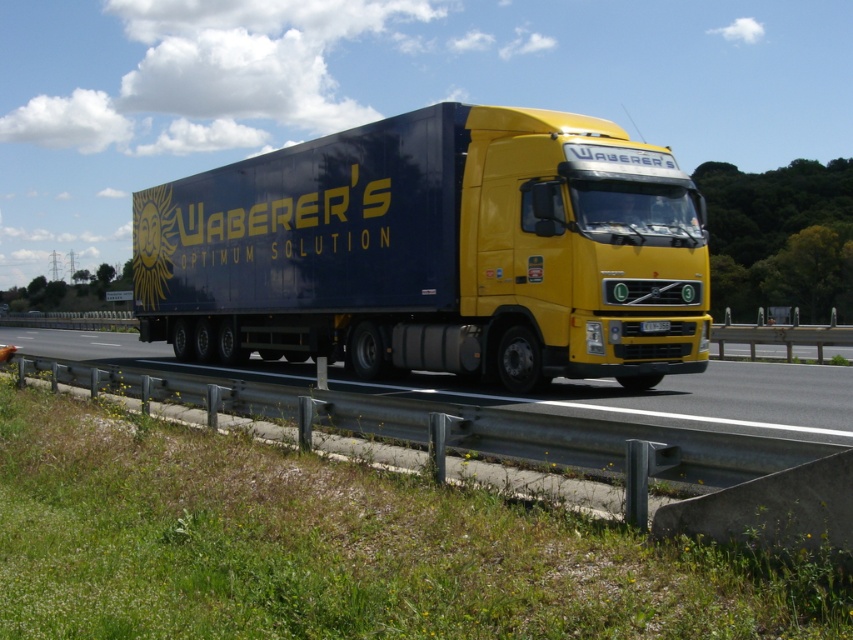
Between matte black trailer truck at center and metallic gray highway at lower center, which one is positioned higher?

Positioned higher is matte black trailer truck at center.

Is matte black trailer truck at center bigger than metallic gray highway at lower center?

Yes.

Measure the distance between matte black trailer truck at center and camera.

matte black trailer truck at center is 38.92 feet away from camera.

Where is `matte black trailer truck at center`? Image resolution: width=853 pixels, height=640 pixels. matte black trailer truck at center is located at coordinates (434, 252).